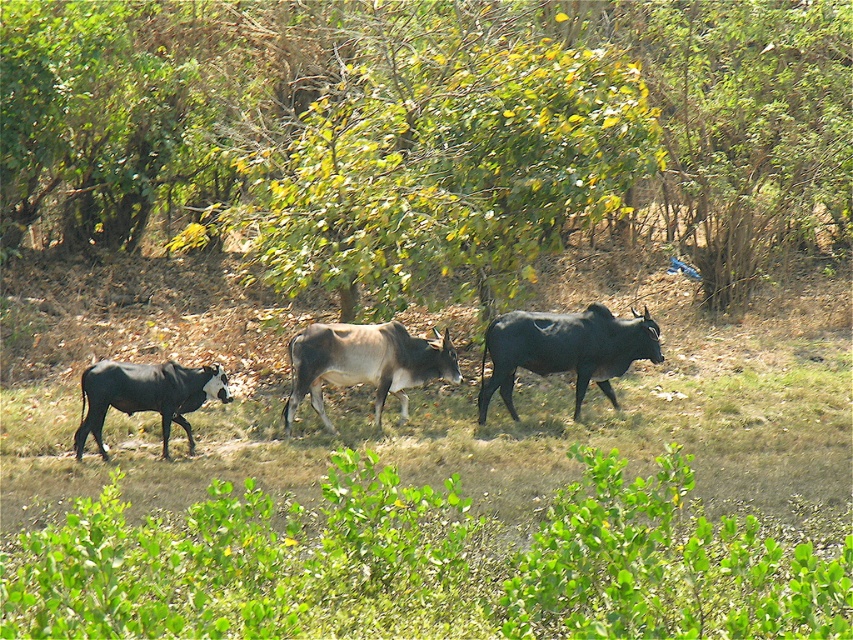
Can you confirm if green leafy tree at center is positioned above black glossy bull at center?

Yes, green leafy tree at center is above black glossy bull at center.

This screenshot has height=640, width=853. What do you see at coordinates (442, 163) in the screenshot?
I see `green leafy tree at center` at bounding box center [442, 163].

Describe the element at coordinates (442, 163) in the screenshot. I see `green leafy tree at center` at that location.

Locate an element on the screen. This screenshot has width=853, height=640. green leafy tree at center is located at coordinates (x=442, y=163).

Based on the photo, between green leafy grass at lower center and brown glossy cow at center, which one appears on the right side from the viewer's perspective?

green leafy grass at lower center

Which is in front, point (619, 552) or point (405, 339)?

Point (619, 552) is in front.

Is point (624, 577) positioned in front of point (376, 420)?

Yes, it is in front of point (376, 420).

At what (x,y) coordinates should I click in order to perform the action: click on green leafy grass at lower center. Please return your answer as a coordinate pair (x, y). Looking at the image, I should click on (422, 564).

Does black glossy bull at center come behind black glossy cow at left?

Yes, black glossy bull at center is behind black glossy cow at left.

Does black glossy bull at center appear under black glossy cow at left?

Incorrect, black glossy bull at center is not positioned below black glossy cow at left.

Does point (577, 346) come behind point (113, 381)?

That is True.

The width and height of the screenshot is (853, 640). Find the location of `black glossy bull at center`. black glossy bull at center is located at coordinates (564, 349).